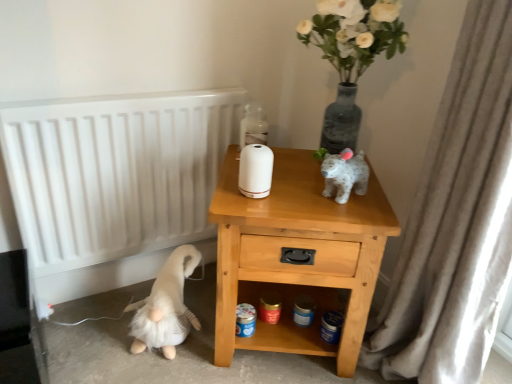
Where is `free spot below white matte radiator at left (from a real-world perspective)`? The image size is (512, 384). free spot below white matte radiator at left (from a real-world perspective) is located at coordinates (104, 292).